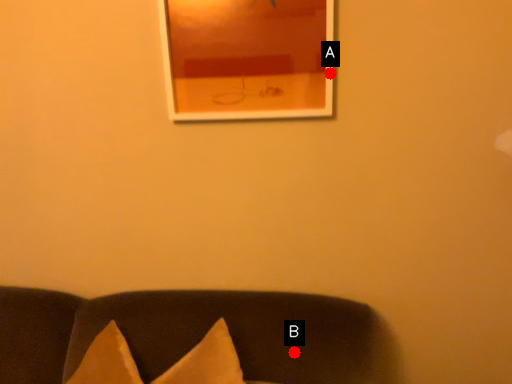
Question: Two points are circled on the image, labeled by A and B beside each circle. Which point is farther from the camera taking this photo?

Choices:
 (A) A is further
 (B) B is further

Answer: (A)